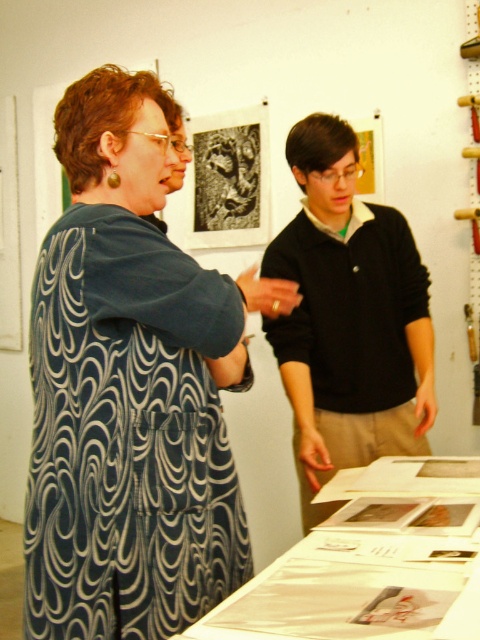
Question: Which point is farther to the camera?

Choices:
 (A) (48, 262)
 (B) (208, 221)

Answer: (B)

Question: Can you confirm if blue swirled fabric at center is wider than black stone carving at center?

Choices:
 (A) no
 (B) yes

Answer: (B)

Question: Does blue swirled fabric at center have a larger size compared to black stone carving at center?

Choices:
 (A) no
 (B) yes

Answer: (B)

Question: Is blue swirled fabric at center bigger than black stone carving at center?

Choices:
 (A) yes
 (B) no

Answer: (A)

Question: Estimate the real-world distances between objects in this image. Which object is closer to the black sweater at center?

Choices:
 (A) blue swirled fabric at center
 (B) black stone carving at center

Answer: (A)

Question: Which object is positioned farthest from the blue swirled fabric at center?

Choices:
 (A) black stone carving at center
 (B) black sweater at center

Answer: (A)